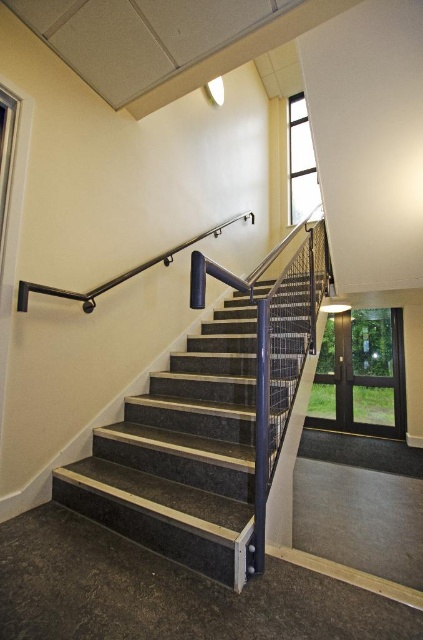
You are carrying a large painting that is 30 inches wide. You need to place it against the wall near the marble stairs at center and the black metal handrail at upper center. Will the painting fit between them without overlapping either?

The marble stairs at center is 30.49 inches from the black metal handrail at upper center. Since the painting is 30 inches wide, it will fit between them without overlapping either as there is enough space.

You are standing at the bottom of the staircase and see a point marked at coordinates (183, 454). Where is this point located in relation to the staircase?

The point marked at coordinates (183, 454) is located on the marble stairs at the center.

You are a painter needing to reach the ceiling above the marble stairs at center. You have a ladder that can reach 3 meters. The black metal handrail at upper center is in your way. Can you safely extend your ladder to reach the ceiling without hitting the handrail?

The marble stairs at center has a lesser height compared to black metal handrail at upper center. Since the stairs are shorter than the handrail, the ladder can be extended vertically upwards past the handrail to reach the ceiling safely as long as the total height of the ladder plus your reach doesn